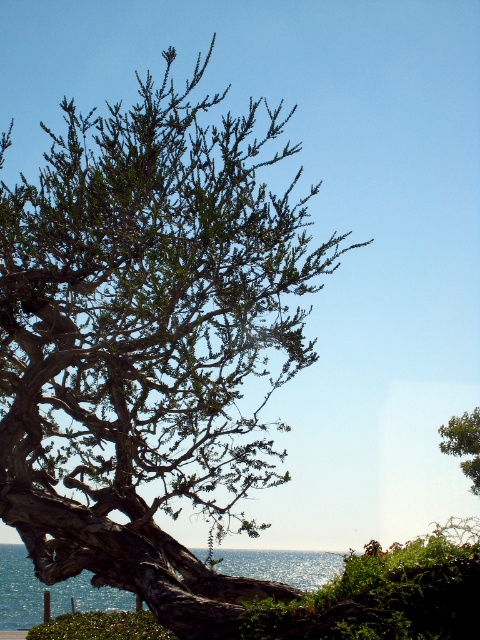
Question: Does blue reflective water at lower left appear on the right side of green leafy tree at upper right?

Choices:
 (A) yes
 (B) no

Answer: (B)

Question: Which point is closer to the camera taking this photo?

Choices:
 (A) (15, 621)
 (B) (471, 492)

Answer: (B)

Question: Which point appears closest to the camera in this image?

Choices:
 (A) (477, 417)
 (B) (322, 570)
 (C) (131, 298)

Answer: (C)

Question: Does green leafy tree at center appear under blue reflective water at lower left?

Choices:
 (A) yes
 (B) no

Answer: (B)

Question: Estimate the real-world distances between objects in this image. Which object is farther from the green leafy tree at upper right?

Choices:
 (A) blue reflective water at lower left
 (B) green leafy tree at center

Answer: (A)

Question: Is green leafy tree at center positioned before green leafy tree at upper right?

Choices:
 (A) yes
 (B) no

Answer: (A)